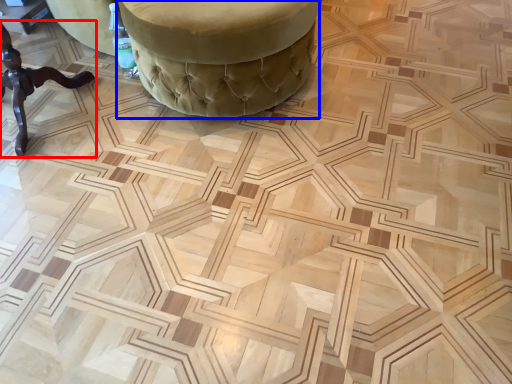
Question: Which object appears closest to the camera in this image, furniture (highlighted by a red box) or furniture (highlighted by a blue box)?

Choices:
 (A) furniture
 (B) furniture

Answer: (A)